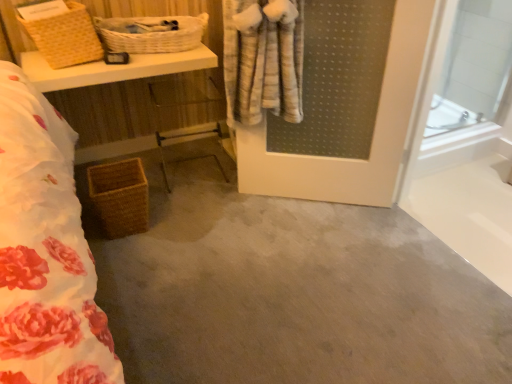
Question: In terms of width, does white wicker basket at upper left, which is counted as the 1th basket, starting from the top, look wider or thinner when compared to gray carpet at center?

Choices:
 (A) thin
 (B) wide

Answer: (A)

Question: In the image, is white wicker basket at upper left, which is counted as the 1th basket, starting from the top, positioned in front of or behind gray carpet at center?

Choices:
 (A) front
 (B) behind

Answer: (B)

Question: Estimate the real-world distances between objects in this image. Which object is closer to the woven brown basket at upper left, marked as the second basket in a top-to-bottom arrangement?

Choices:
 (A) transparent glass door at right
 (B) woven brown basket at lower left, the third basket in the top-to-bottom sequence
 (C) gray carpet at center
 (D) woven wicker basket at lower left
 (E) white wicker basket at upper left, which is the 3th basket in bottom-to-top order

Answer: (D)

Question: Which of these objects is positioned closest to the gray carpet at center?

Choices:
 (A) woven wicker basket at lower left
 (B) transparent glass door at right
 (C) woven brown basket at lower left, which is counted as the 1th basket, starting from the bottom
 (D) woven brown basket at upper left, marked as the second basket in a top-to-bottom arrangement
 (E) white wicker basket at upper left, which is the 3th basket in bottom-to-top order

Answer: (C)